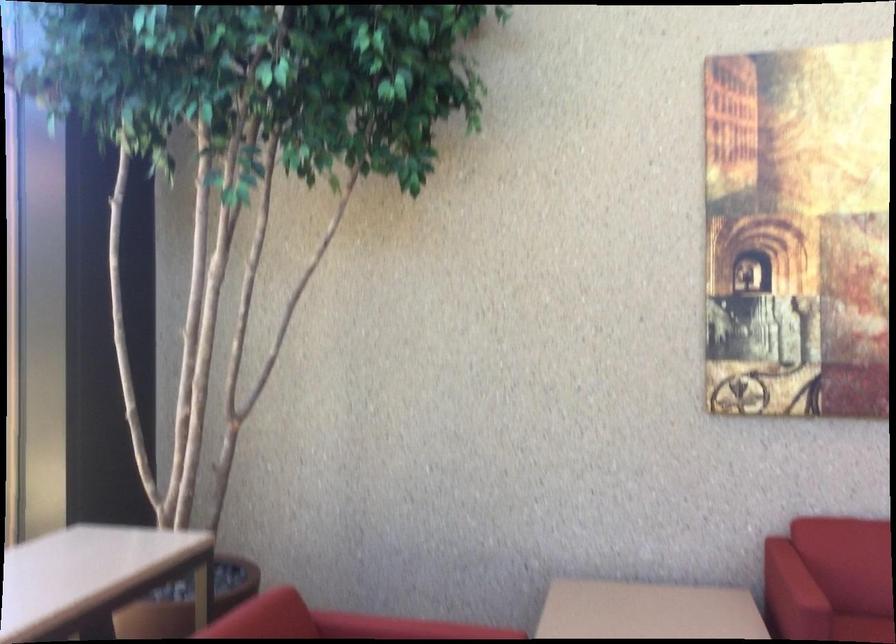
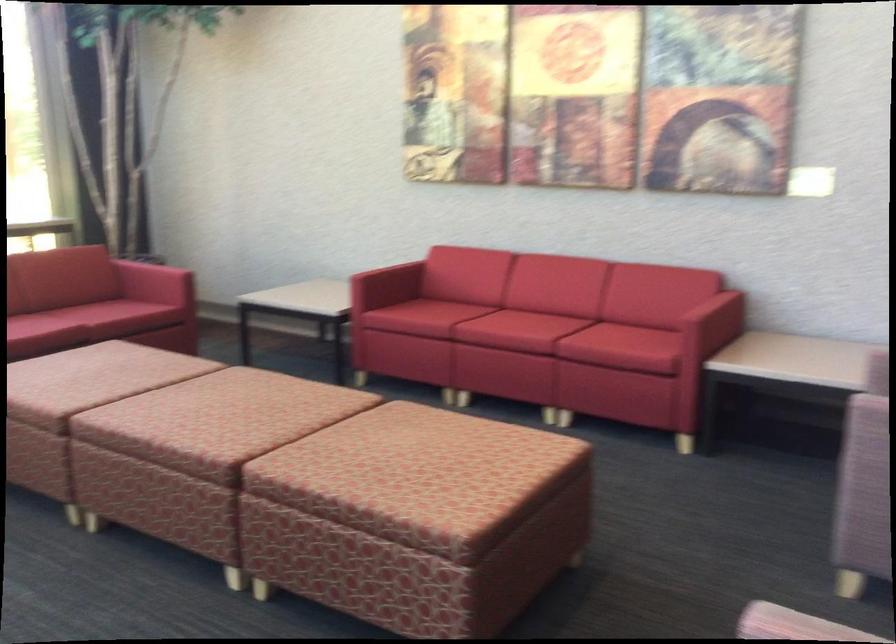
In a continuous first-person perspective shot, in which direction is the camera moving?

The cameraman walked toward right, backward.